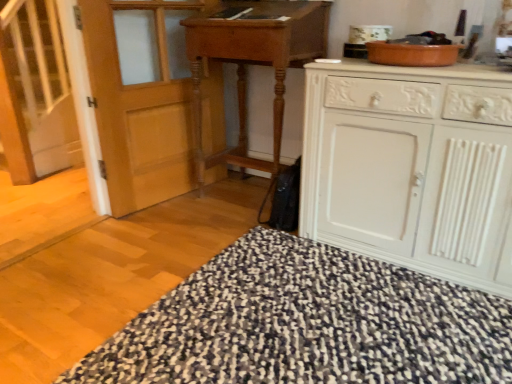
Question: From a real-world perspective, is white wooden stairs at left positioned under black textured rug at lower center based on gravity?

Choices:
 (A) no
 (B) yes

Answer: (A)

Question: Is white wooden stairs at left further to camera compared to black textured rug at lower center?

Choices:
 (A) yes
 (B) no

Answer: (A)

Question: Is white wooden stairs at left aimed at black textured rug at lower center?

Choices:
 (A) no
 (B) yes

Answer: (A)

Question: From the image's perspective, is white wooden stairs at left on top of black textured rug at lower center?

Choices:
 (A) no
 (B) yes

Answer: (B)

Question: Does white wooden stairs at left lie in front of black textured rug at lower center?

Choices:
 (A) no
 (B) yes

Answer: (A)

Question: Is black textured rug at lower center situated inside wooden table at center or outside?

Choices:
 (A) outside
 (B) inside

Answer: (A)

Question: Relative to wooden table at center, is black textured rug at lower center in front or behind?

Choices:
 (A) front
 (B) behind

Answer: (A)

Question: From a real-world perspective, is black textured rug at lower center above or below wooden table at center?

Choices:
 (A) above
 (B) below

Answer: (B)

Question: Considering the positions of black textured rug at lower center and wooden table at center in the image, is black textured rug at lower center taller or shorter than wooden table at center?

Choices:
 (A) short
 (B) tall

Answer: (A)

Question: Would you say wooden table at center is to the left or to the right of black textured rug at lower center in the picture?

Choices:
 (A) right
 (B) left

Answer: (B)

Question: From the image's perspective, is wooden table at center located above or below black textured rug at lower center?

Choices:
 (A) above
 (B) below

Answer: (A)

Question: Looking at their shapes, would you say wooden table at center is wider or thinner than black textured rug at lower center?

Choices:
 (A) wide
 (B) thin

Answer: (B)

Question: Based on their sizes in the image, would you say wooden table at center is bigger or smaller than black textured rug at lower center?

Choices:
 (A) small
 (B) big

Answer: (B)

Question: Would you say white wooden stairs at left is to the left or to the right of white painted wood cabinet at right in the picture?

Choices:
 (A) left
 (B) right

Answer: (A)

Question: Is point (71, 152) positioned closer to the camera than point (355, 182)?

Choices:
 (A) farther
 (B) closer

Answer: (A)